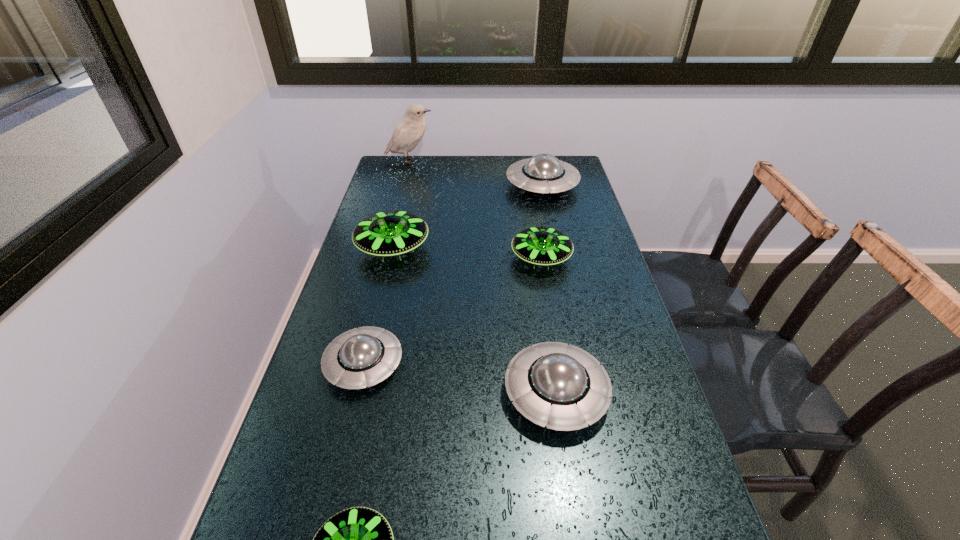
Locate an element on the screen. The height and width of the screenshot is (540, 960). vacant space situated 0.080m on the back of the biggest green saucer is located at coordinates (401, 213).

This screenshot has width=960, height=540. Identify the location of free space located 0.110m on the front of the second smallest gray saucer. (572, 498).

Locate an element on the screen. The height and width of the screenshot is (540, 960). free space located 0.300m on the left of the second smallest green saucer is located at coordinates point(411,258).

Find the location of a particular element. vacant region located 0.180m on the right of the leftmost gray saucer is located at coordinates (481, 364).

This screenshot has width=960, height=540. Find the location of `bird that is at the far edge`. bird that is at the far edge is located at coordinates (409, 131).

At what (x,y) coordinates should I click in order to perform the action: click on saucer that is at the far edge. Please return your answer as a coordinate pair (x, y). The width and height of the screenshot is (960, 540). Looking at the image, I should click on (543, 173).

You are a GUI agent. You are given a task and a screenshot of the screen. Output one action in this format:
    pyautogui.click(x=<x>, y=<y>)
    Task: Click on the bird that is at the left edge
    The height and width of the screenshot is (540, 960).
    Given the screenshot: What is the action you would take?
    (409, 131)

Where is `object at the far left corner`? The height and width of the screenshot is (540, 960). object at the far left corner is located at coordinates (409, 131).

Locate an element on the screen. The height and width of the screenshot is (540, 960). object that is at the far right corner is located at coordinates (543, 173).

Find the location of a particular element. vacant region at the far edge of the desktop is located at coordinates click(454, 162).